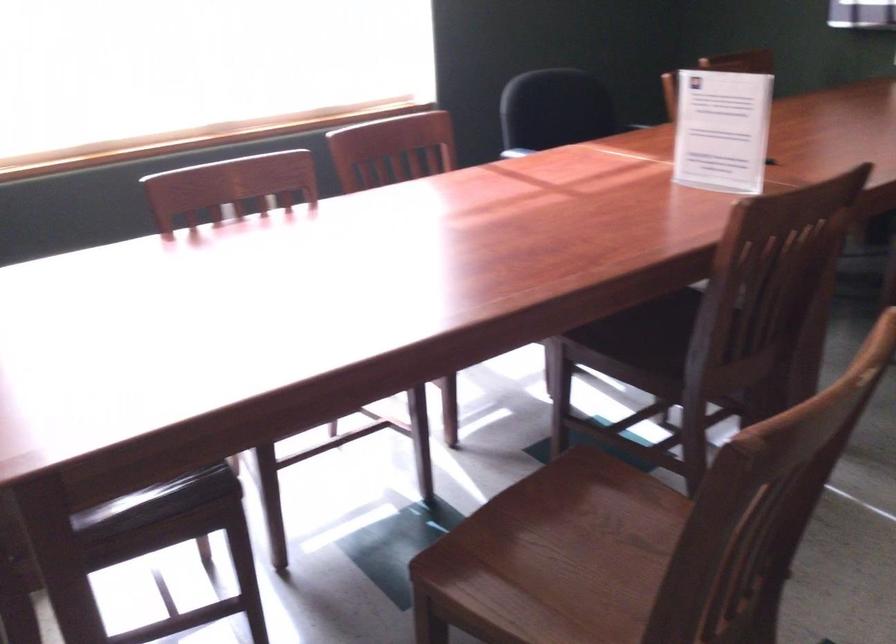
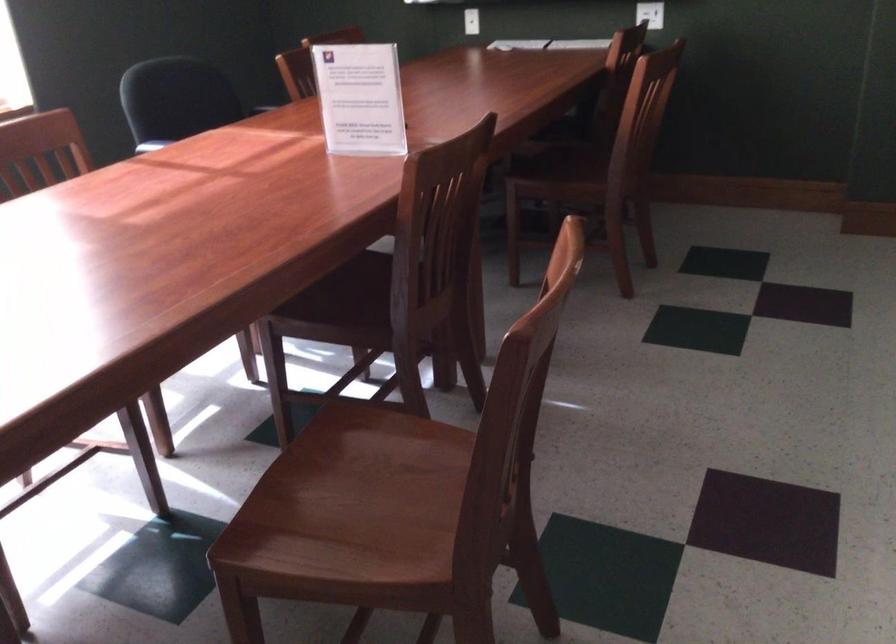
Where in the second image is the point corresponding to [717,128] from the first image?

(359, 98)